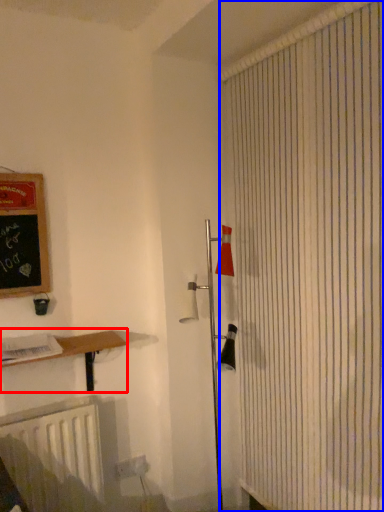
Question: Which object appears closest to the camera in this image, shelf (highlighted by a red box) or shower curtain (highlighted by a blue box)?

Choices:
 (A) shelf
 (B) shower curtain

Answer: (B)